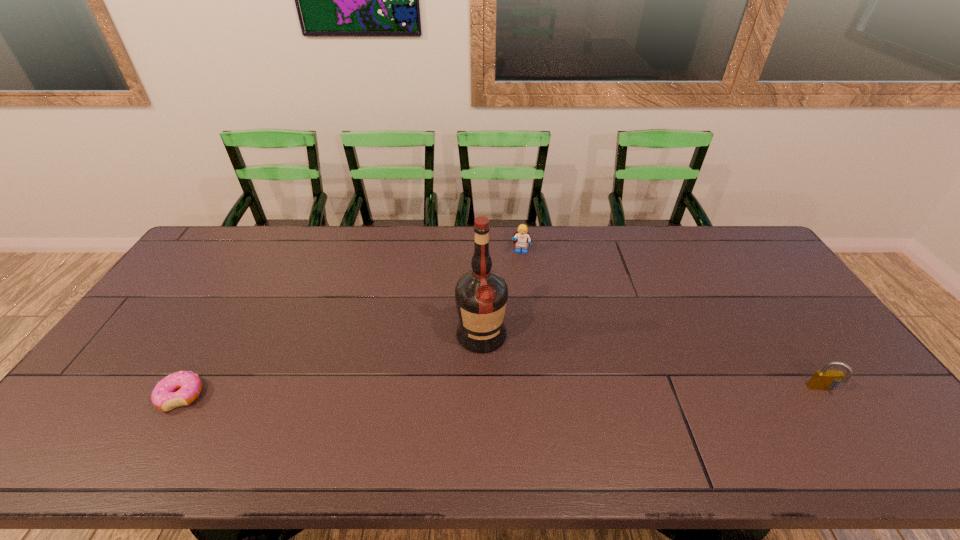
At what (x,y) coordinates should I click in order to perform the action: click on the shortest object. Please return your answer as a coordinate pair (x, y). The width and height of the screenshot is (960, 540). Looking at the image, I should click on (182, 388).

The image size is (960, 540). Identify the location of doughnut. (182, 388).

The image size is (960, 540). Identify the location of padlock. (825, 379).

Where is `the third nearest object`? This screenshot has width=960, height=540. the third nearest object is located at coordinates (481, 295).

Where is `the tallest object`? This screenshot has height=540, width=960. the tallest object is located at coordinates (481, 295).

Locate an element on the screen. The width and height of the screenshot is (960, 540). the farthest object is located at coordinates (522, 237).

The image size is (960, 540). Find the location of `the second object from right to left`. the second object from right to left is located at coordinates [522, 237].

I want to click on free space located 0.100m on the back of the leftmost object, so click(209, 348).

Image resolution: width=960 pixels, height=540 pixels. I want to click on vacant region located on the side with the combination dials of the rightmost object, so point(842,418).

In order to click on free space located 0.090m on the surface of the tallest object in this screenshot , I will do `click(492, 381)`.